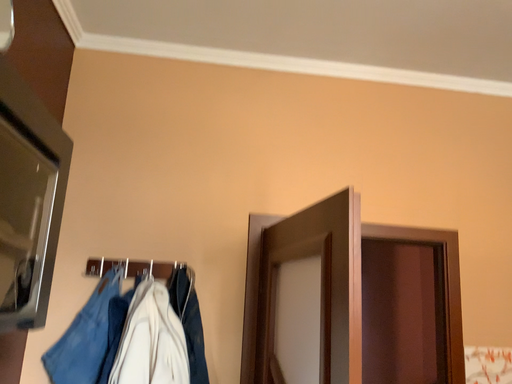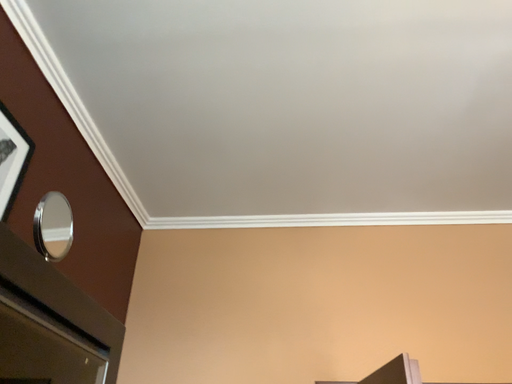
Question: How did the camera likely rotate when shooting the video?

Choices:
 (A) rotated downward
 (B) rotated upward

Answer: (B)